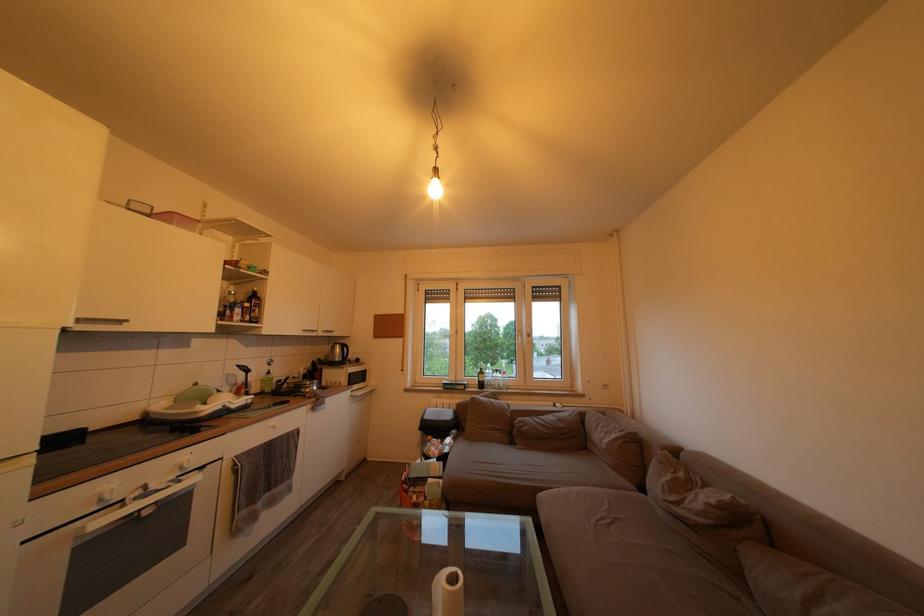
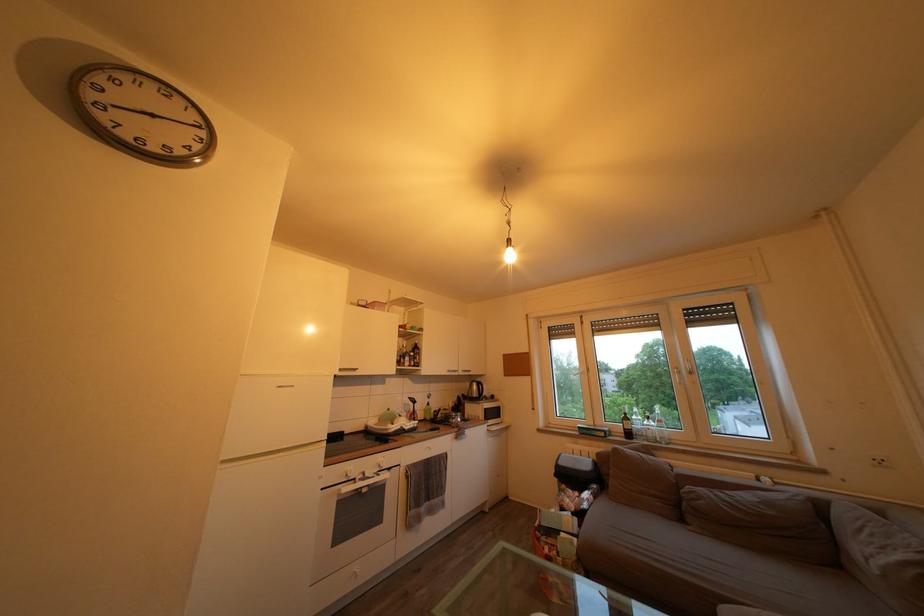
Locate, in the second image, the point that corresponds to point (613, 392) in the first image.

(889, 468)